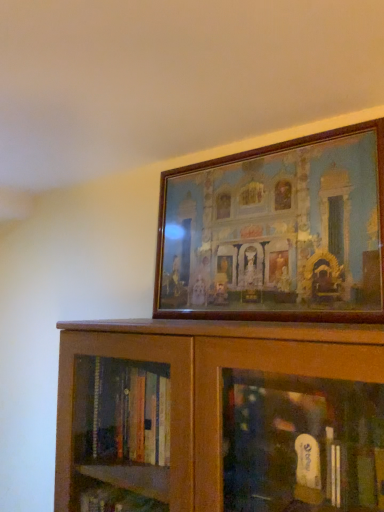
Find the location of `empty space that is ontop of wooden picture frame at upper center (from a real-world perspective)`. empty space that is ontop of wooden picture frame at upper center (from a real-world perspective) is located at coordinates (264, 146).